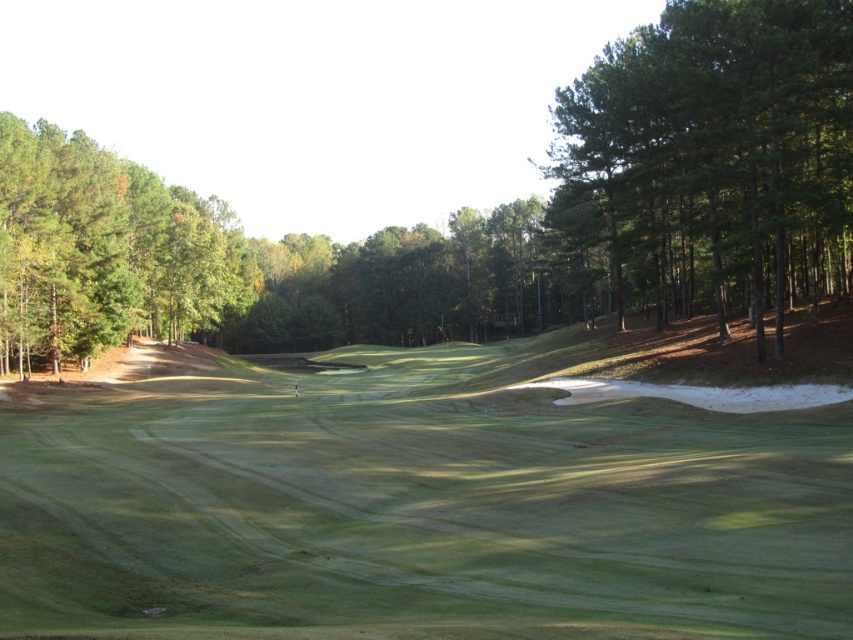
Question: Does green grassy golf course at center appear under green leafy tree at left?

Choices:
 (A) no
 (B) yes

Answer: (B)

Question: Can you confirm if green leafy trees at right is positioned below green leafy tree at left?

Choices:
 (A) yes
 (B) no

Answer: (B)

Question: Among these points, which one is nearest to the camera?

Choices:
 (A) (94, 202)
 (B) (744, 184)

Answer: (B)

Question: Which of the following is the farthest from the observer?

Choices:
 (A) (134, 266)
 (B) (677, 164)
 (C) (161, 396)

Answer: (A)

Question: Which point is closer to the camera?

Choices:
 (A) (74, 422)
 (B) (659, 180)
 (C) (30, 248)

Answer: (A)

Question: Is green grassy golf course at center thinner than green leafy trees at right?

Choices:
 (A) yes
 (B) no

Answer: (A)